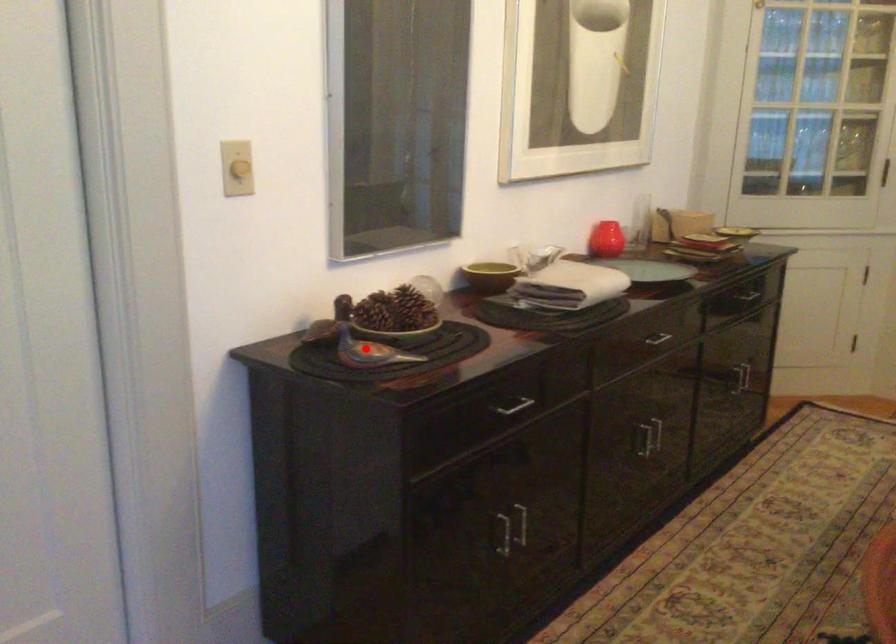
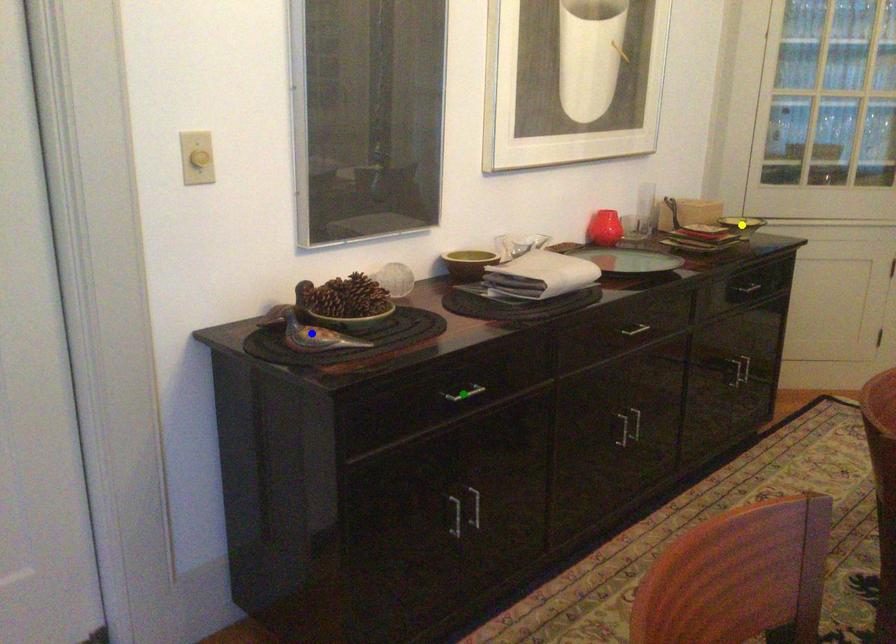
Question: I am providing you with two images of the same scene from different viewpoints. A red point is marked on the first image. You are given multiple points on the second image. Can you choose the point in image 2 that corresponds to the point in image 1?

Choices:
 (A) green point
 (B) yellow point
 (C) blue point

Answer: (C)